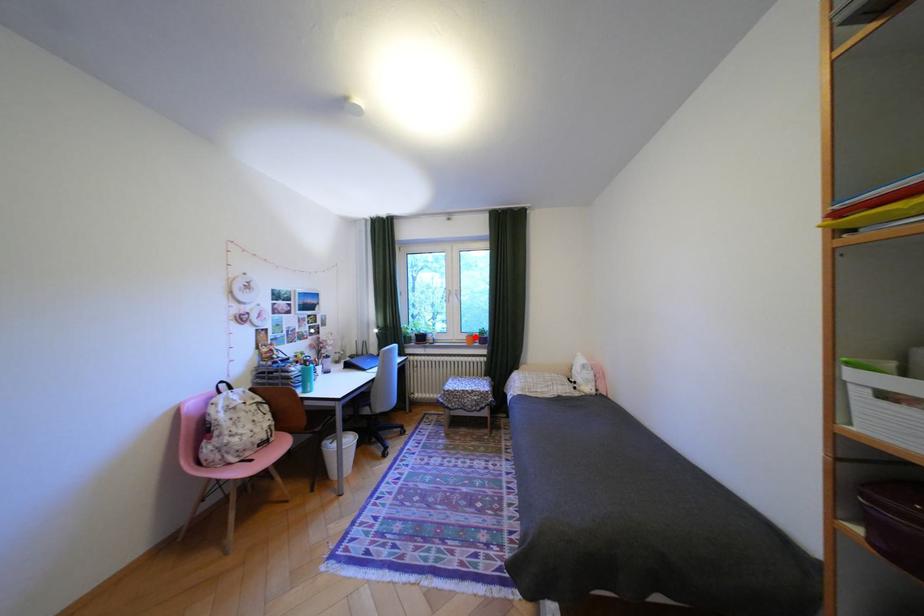
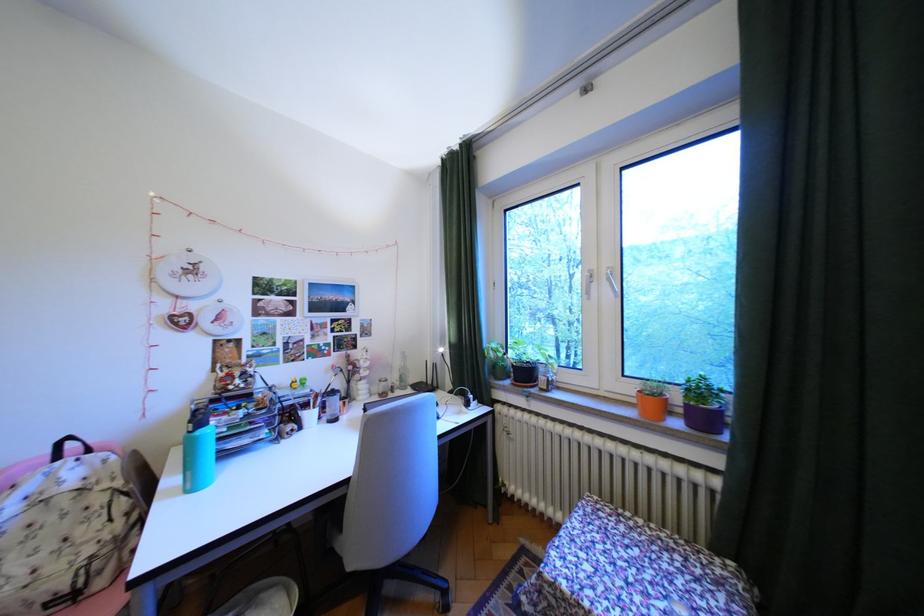
Where in the second image is the point corresponding to the highlighted location from the first image?

(641, 390)